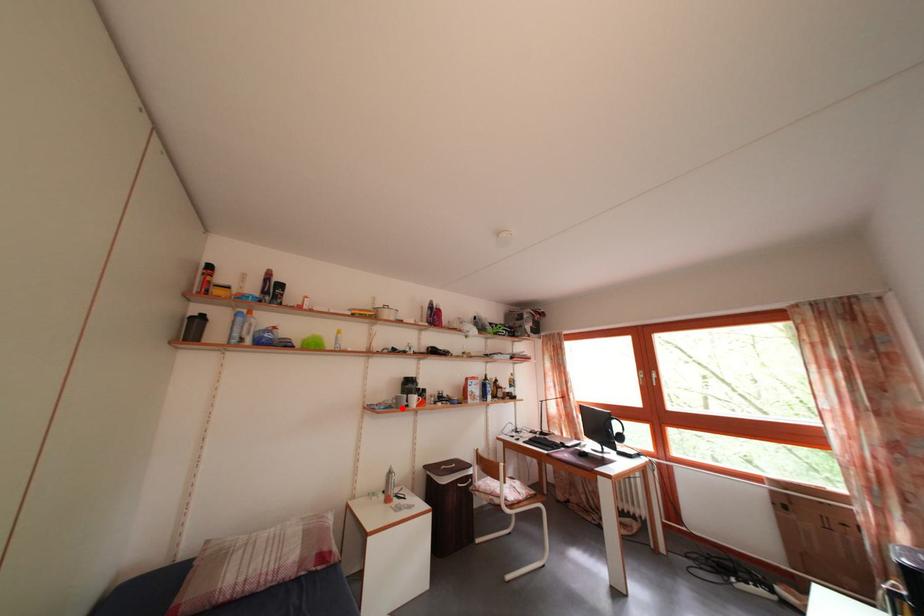
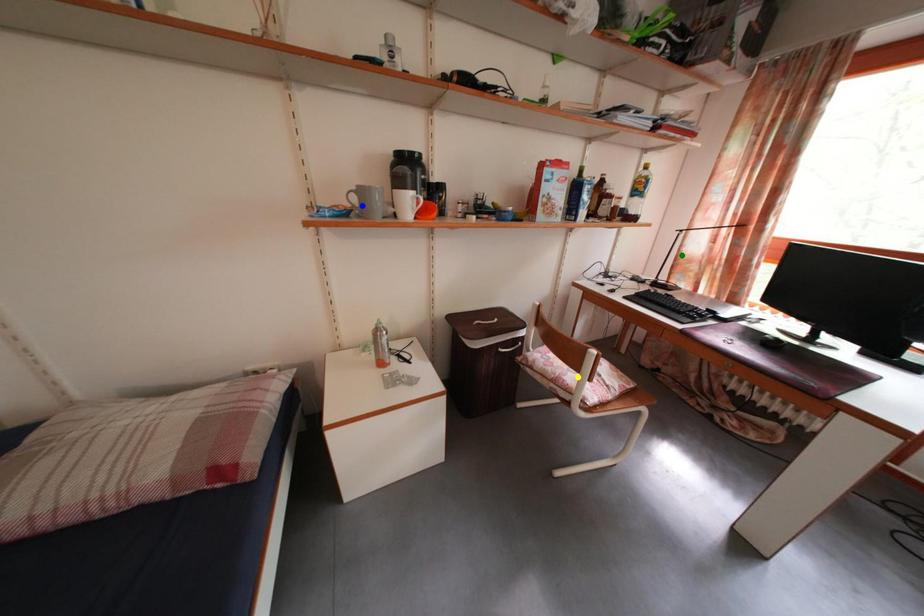
Question: I am providing you with two images of the same scene from different viewpoints. A red point is marked on the first image. You are given multiple points on the second image. Which point in image 2 represents the same 3d spot as the red point in image 1?

Choices:
 (A) yellow point
 (B) blue point
 (C) green point

Answer: (B)